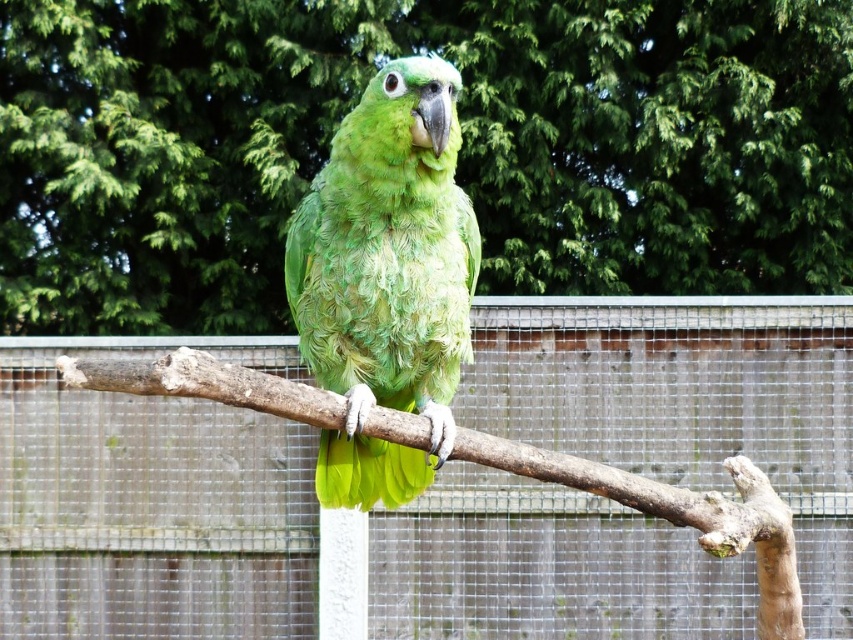
Which is below, green leafy tree at center or green matte parrot at center?

green matte parrot at center is below.

Who is positioned more to the left, green leafy tree at center or green matte parrot at center?

From the viewer's perspective, green leafy tree at center appears more on the left side.

Which is behind, point (123, 88) or point (303, 282)?

The point (123, 88) is more distant.

This screenshot has height=640, width=853. I want to click on green leafy tree at center, so click(x=459, y=156).

Who is positioned more to the right, green leafy tree at center or metallic wire mesh at center?

metallic wire mesh at center is more to the right.

Which of these two, green leafy tree at center or metallic wire mesh at center, stands shorter?

A: With less height is metallic wire mesh at center.

The height and width of the screenshot is (640, 853). What are the coordinates of `green leafy tree at center` in the screenshot? It's located at (459, 156).

Does point (554, 416) lie behind point (378, 397)?

Yes, point (554, 416) is behind point (378, 397).

Does point (291, 484) lie in front of point (456, 381)?

That is False.

What do you see at coordinates (151, 500) in the screenshot?
I see `metallic wire mesh at center` at bounding box center [151, 500].

At what (x,y) coordinates should I click in order to perform the action: click on metallic wire mesh at center. Please return your answer as a coordinate pair (x, y). Image resolution: width=853 pixels, height=640 pixels. Looking at the image, I should click on (151, 500).